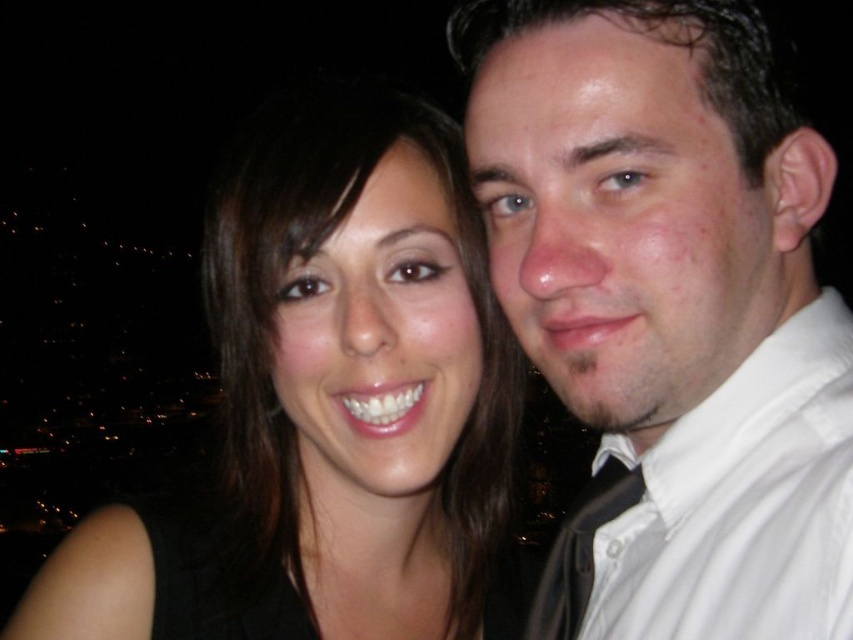
Question: Where is black matte hair at upper left located in relation to white cotton shirt at right in the image?

Choices:
 (A) below
 (B) above

Answer: (B)

Question: Which is nearer to the white cotton shirt at right?

Choices:
 (A) black matte hair at upper left
 (B) white shirt at right

Answer: (B)

Question: In this image, where is white shirt at right located relative to white cotton shirt at right?

Choices:
 (A) above
 (B) below

Answer: (A)

Question: Which point is closer to the camera taking this photo?

Choices:
 (A) (827, 440)
 (B) (283, 358)

Answer: (A)

Question: Does white shirt at right come behind white cotton shirt at right?

Choices:
 (A) yes
 (B) no

Answer: (A)

Question: Which of the following is the farthest from the observer?

Choices:
 (A) white shirt at right
 (B) black matte hair at upper left

Answer: (B)